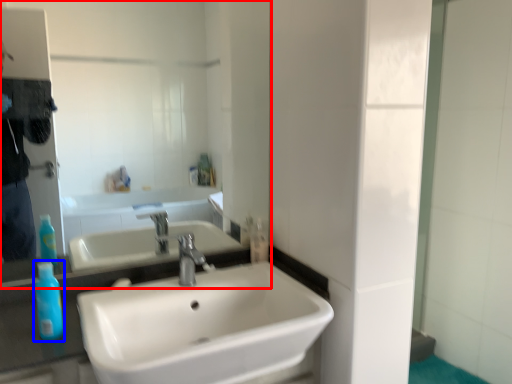
Question: Which point is closer to the camera, mirror (highlighted by a red box) or mouthwash (highlighted by a blue box)?

Choices:
 (A) mirror
 (B) mouthwash

Answer: (B)